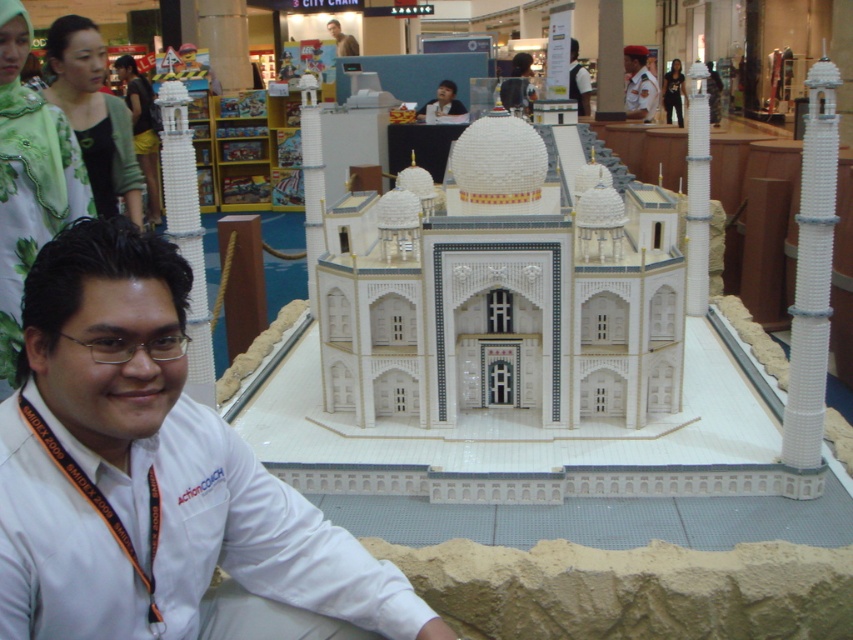
Question: Is white uniform at center in front of matte white shirt at center?

Choices:
 (A) no
 (B) yes

Answer: (A)

Question: Is matte green dress at upper left to the left of white uniform at center from the viewer's perspective?

Choices:
 (A) no
 (B) yes

Answer: (B)

Question: Which point is farther to the camera?

Choices:
 (A) green textured jacket at upper left
 (B) matte black hair at upper center

Answer: (B)

Question: Which of the following is the farthest from the observer?

Choices:
 (A) matte white face at upper center
 (B) green textured jacket at upper left
 (C) green floral scarf at upper left

Answer: (A)

Question: Among these objects, which one is farthest from the camera?

Choices:
 (A) white uniform at center
 (B) matte white face at upper center
 (C) green textured jacket at upper left
 (D) matte black dress at center

Answer: (D)

Question: Is green floral scarf at upper left closer to the viewer compared to white uniform at center?

Choices:
 (A) no
 (B) yes

Answer: (B)